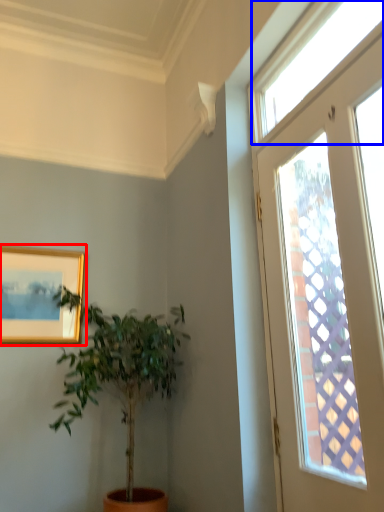
Question: Which point is further to the camera, picture frame (highlighted by a red box) or window (highlighted by a blue box)?

Choices:
 (A) picture frame
 (B) window

Answer: (A)